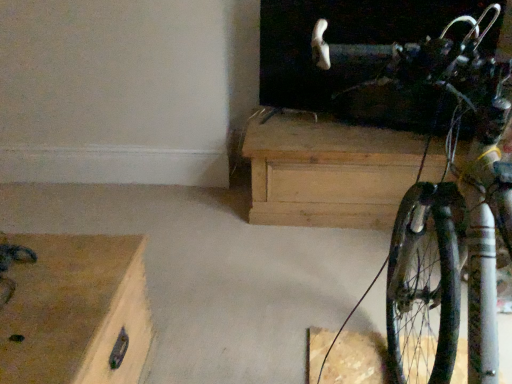
Question: Is shiny metallic bicycle at right facing towards wooden chest at lower left, the 1th chest of drawers viewed from the front?

Choices:
 (A) no
 (B) yes

Answer: (A)

Question: Can you confirm if shiny metallic bicycle at right is thinner than wooden chest at lower left, which is the 1th chest of drawers in bottom-to-top order?

Choices:
 (A) yes
 (B) no

Answer: (B)

Question: From the image's perspective, is shiny metallic bicycle at right under wooden chest at lower left, arranged as the second chest of drawers when viewed from the top?

Choices:
 (A) yes
 (B) no

Answer: (B)

Question: Is wooden chest at lower left, the 2th chest of drawers viewed from the right, surrounded by shiny metallic bicycle at right?

Choices:
 (A) no
 (B) yes

Answer: (A)

Question: Is shiny metallic bicycle at right smaller than wooden chest at lower left, the 2th chest of drawers viewed from the right?

Choices:
 (A) yes
 (B) no

Answer: (B)

Question: Considering the relative sizes of shiny metallic bicycle at right and wooden chest at lower left, arranged as the second chest of drawers when viewed from the top, in the image provided, is shiny metallic bicycle at right bigger than wooden chest at lower left, arranged as the second chest of drawers when viewed from the top,?

Choices:
 (A) yes
 (B) no

Answer: (A)

Question: Is natural wood chest at center, which is the first chest of drawers in back-to-front order, at the left side of wooden chest at lower left, which appears as the 2th chest of drawers when viewed from the back?

Choices:
 (A) yes
 (B) no

Answer: (B)

Question: Would you say natural wood chest at center, which is counted as the 2th chest of drawers, starting from the front, contains wooden chest at lower left, the 2th chest of drawers viewed from the right?

Choices:
 (A) no
 (B) yes

Answer: (A)

Question: Are natural wood chest at center, which ranks as the first chest of drawers in top-to-bottom order, and wooden chest at lower left, which appears as the 2th chest of drawers when viewed from the back, beside each other?

Choices:
 (A) yes
 (B) no

Answer: (B)

Question: Does natural wood chest at center, which is counted as the 2th chest of drawers, starting from the front, have a greater height compared to wooden chest at lower left, the 1th chest of drawers viewed from the front?

Choices:
 (A) no
 (B) yes

Answer: (B)

Question: Does natural wood chest at center, positioned as the second chest of drawers in bottom-to-top order, turn towards wooden chest at lower left, which appears as the 2th chest of drawers when viewed from the back?

Choices:
 (A) no
 (B) yes

Answer: (B)

Question: Can you confirm if natural wood chest at center, which is counted as the 2th chest of drawers, starting from the front, is shorter than wooden chest at lower left, which is the 1th chest of drawers in bottom-to-top order?

Choices:
 (A) yes
 (B) no

Answer: (B)

Question: Is shiny metallic bicycle at right shorter than natural wood chest at center, positioned as the second chest of drawers in bottom-to-top order?

Choices:
 (A) yes
 (B) no

Answer: (B)